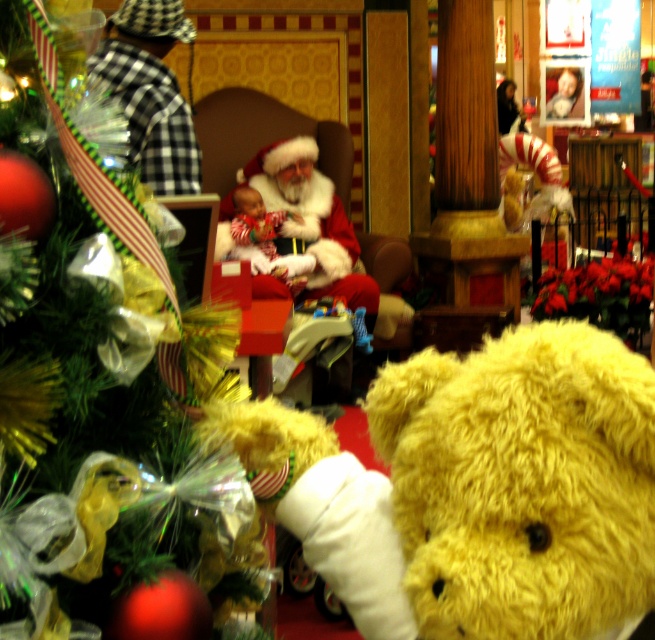
Does shiny green tinsel at left appear on the left side of soft plush baby at center?

In fact, shiny green tinsel at left is to the right of soft plush baby at center.

Can you confirm if shiny green tinsel at left is thinner than soft plush baby at center?

Indeed, shiny green tinsel at left has a lesser width compared to soft plush baby at center.

Does point (198, 392) come closer to viewer compared to point (259, 246)?

That is True.

This screenshot has width=655, height=640. Find the location of `shiny green tinsel at left`. shiny green tinsel at left is located at coordinates (109, 408).

Which is in front, point (337, 205) or point (263, 260)?

Point (263, 260) is in front.

In the scene shown: Is fuzzy red santa at center further to the viewer compared to soft plush baby at center?

No.

Is point (343, 276) positioned in front of point (293, 218)?

That is True.

Where is `fuzzy red santa at center`? Image resolution: width=655 pixels, height=640 pixels. fuzzy red santa at center is located at coordinates (312, 220).

Between point (31, 621) and point (512, 518), which one is positioned in front?

Positioned in front is point (31, 621).

Who is higher up, shiny green tinsel at left or yellow plush bear at center?

shiny green tinsel at left

Who is more forward, (54, 282) or (639, 570)?

Point (54, 282) is in front.

Locate an element on the screen. This screenshot has height=640, width=655. shiny green tinsel at left is located at coordinates (109, 408).